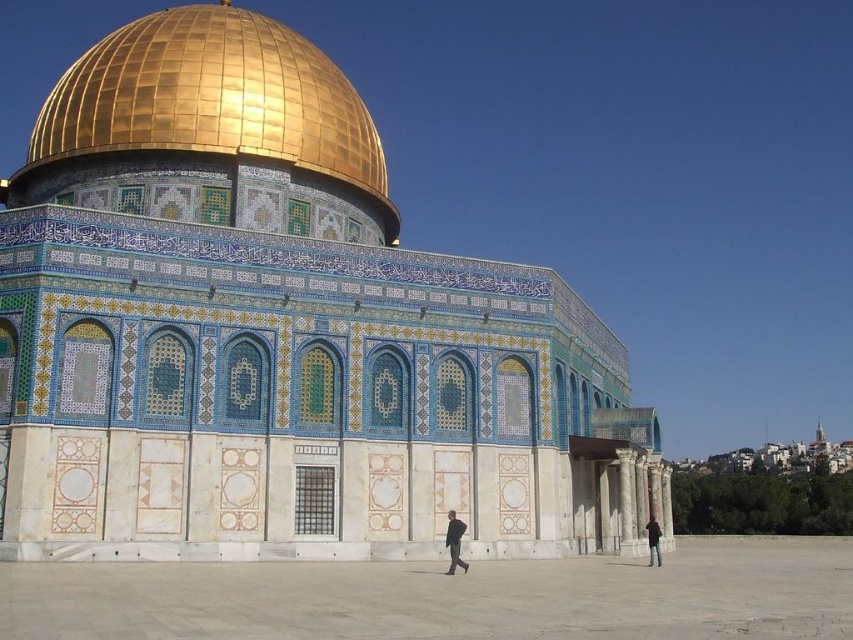
Is gold polished dome at upper center in front of dark gray suit at center?

No, it is not.

Is gold polished dome at upper center taller than dark gray suit at center?

Yes, gold polished dome at upper center is taller than dark gray suit at center.

Is point (166, 144) in front of point (451, 538)?

No, (166, 144) is further to viewer.

Locate an element on the screen. The width and height of the screenshot is (853, 640). gold polished dome at upper center is located at coordinates (212, 99).

Who is positioned more to the left, dark gray suit at center or black fabric at center?

dark gray suit at center is more to the left.

Identify the location of dark gray suit at center. The width and height of the screenshot is (853, 640). (454, 541).

Does point (450, 518) lie in front of point (653, 547)?

No, it is behind (653, 547).

The height and width of the screenshot is (640, 853). Find the location of `dark gray suit at center`. dark gray suit at center is located at coordinates (454, 541).

Does shiny gold dome at upper center have a greater height compared to gold polished dome at upper center?

In fact, shiny gold dome at upper center may be shorter than gold polished dome at upper center.

Is shiny gold dome at upper center closer to the viewer compared to gold polished dome at upper center?

Yes, shiny gold dome at upper center is closer to the viewer.

Which is in front, point (61, 97) or point (194, 8)?

Positioned in front is point (61, 97).

Identify the location of shiny gold dome at upper center. The image size is (853, 640). (x=280, y=332).